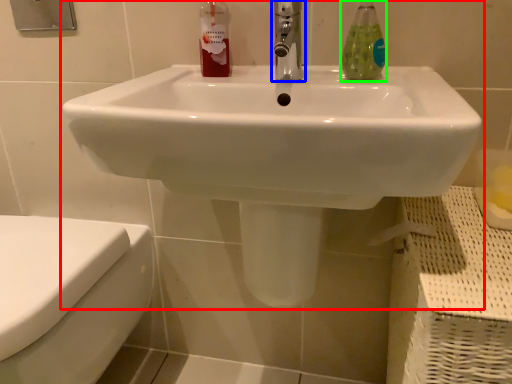
Question: Which object is positioned farthest from sink (highlighted by a red box)? Select from tap (highlighted by a blue box) and soap dispenser (highlighted by a green box).

Choices:
 (A) tap
 (B) soap dispenser

Answer: (B)